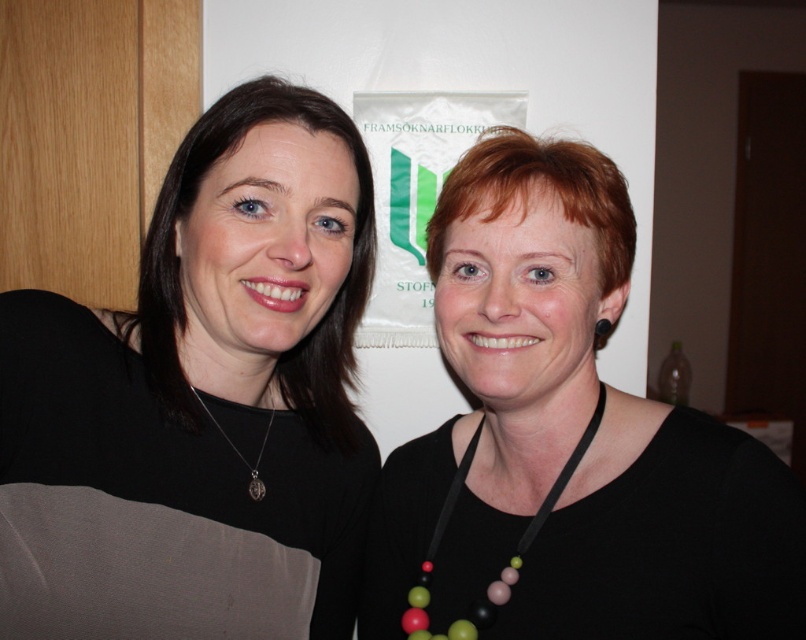
Can you confirm if black matte necklace at upper left is positioned to the right of multicolored beads at center?

Incorrect, black matte necklace at upper left is not on the right side of multicolored beads at center.

Can you confirm if black matte necklace at upper left is bigger than multicolored beads at center?

Yes, black matte necklace at upper left is bigger than multicolored beads at center.

Between point (322, 176) and point (476, 627), which one is positioned behind?

Positioned behind is point (476, 627).

Find the location of `black matte necklace at upper left`. black matte necklace at upper left is located at coordinates (202, 401).

This screenshot has width=806, height=640. What do you see at coordinates (509, 557) in the screenshot?
I see `multicolored beads at center` at bounding box center [509, 557].

Is point (413, 586) closer to viewer compared to point (260, 480)?

No.

Identify the location of multicolored beads at center. This screenshot has width=806, height=640. (509, 557).

This screenshot has width=806, height=640. What do you see at coordinates (202, 401) in the screenshot?
I see `black matte necklace at upper left` at bounding box center [202, 401].

Does black matte necklace at upper left come behind black matte necklace at center?

No, black matte necklace at upper left is in front of black matte necklace at center.

Locate an element on the screen. black matte necklace at upper left is located at coordinates (202, 401).